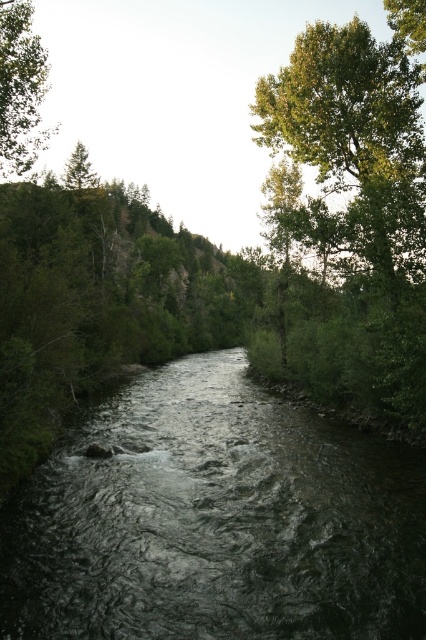
You are standing on a path near the river and want to take a photo of the dark gray water at center and the green matte tree at upper left. Which object should you focus on first if you want both to be in sharp focus?

You should focus on the green matte tree at upper left first because it is closer to you than the dark gray water at center, so focusing on it will ensure both are in focus.

You are an explorer trying to navigate through the riverbank. You see the green leafy tree at upper right and the green matte tree at upper left. Which tree is located to the right of the other?

The green leafy tree at upper right is positioned on the right side of the green matte tree at upper left.